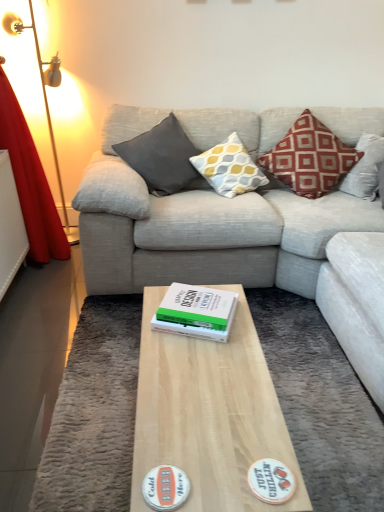
Image resolution: width=384 pixels, height=512 pixels. Find the location of `vacant area that lies in front of red velvet curtain at left`. vacant area that lies in front of red velvet curtain at left is located at coordinates (49, 298).